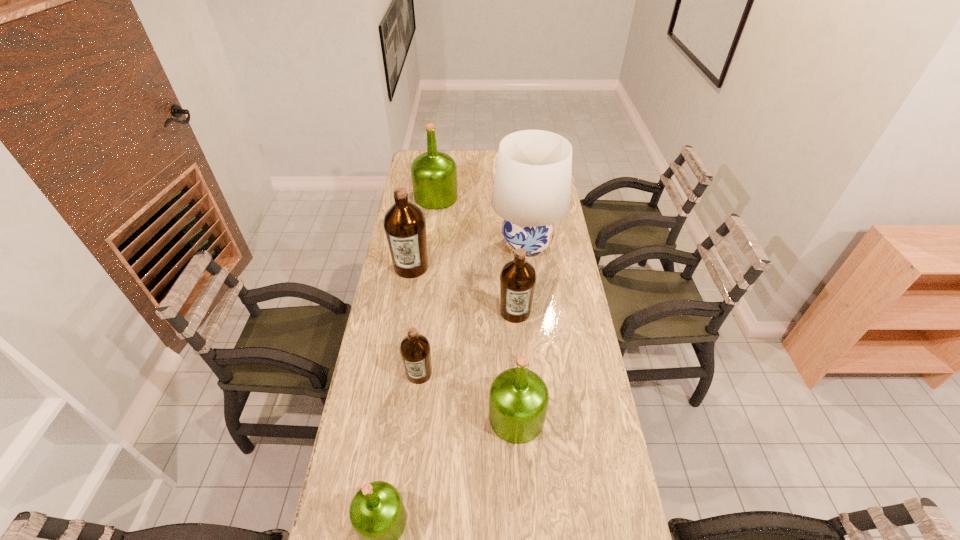
Where is `the nearest brown olive oil`? The image size is (960, 540). the nearest brown olive oil is located at coordinates (415, 350).

Find the location of `the smallest brown olive oil`. the smallest brown olive oil is located at coordinates (415, 350).

This screenshot has height=540, width=960. I want to click on free spot located 0.110m on the front-facing side of the blue lampshade, so click(465, 245).

Where is `free point located on the front-facing side of the blue lampshade`? This screenshot has height=540, width=960. free point located on the front-facing side of the blue lampshade is located at coordinates 420,245.

At what (x,y) coordinates should I click in order to perform the action: click on free space located 0.350m on the front-facing side of the blue lampshade. Please return your answer as a coordinate pair (x, y). The width and height of the screenshot is (960, 540). Looking at the image, I should click on (410, 245).

This screenshot has height=540, width=960. I want to click on vacant area situated on the label of the farthest brown olive oil, so click(x=405, y=305).

You are a GUI agent. You are given a task and a screenshot of the screen. Output one action in this format:
    pyautogui.click(x=<x>, y=<y>)
    Task: Click on the vacant area situated on the back of the farthest object
    The image size is (960, 540).
    Given the screenshot: What is the action you would take?
    pyautogui.click(x=441, y=160)

Identify the location of vacant space located on the label of the fourth farthest object. (522, 408).

Find the location of `vacant space positioned 0.340m on the left of the second nearest olive oil`. vacant space positioned 0.340m on the left of the second nearest olive oil is located at coordinates (377, 417).

You are a GUI agent. You are given a task and a screenshot of the screen. Output one action in this format:
    pyautogui.click(x=<x>, y=<y>)
    Task: Click on the free space located on the label of the fifth farthest object
    
    Given the screenshot: What is the action you would take?
    pyautogui.click(x=415, y=412)